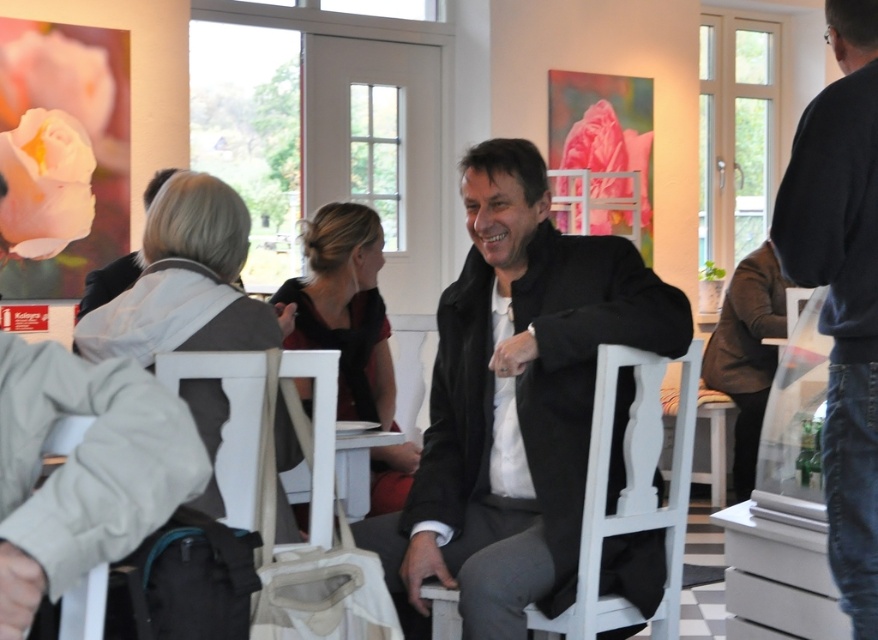
Please look at the scene and locate the point at coordinates (x=841, y=289). What object or feature is located at this position?

The point at coordinates (x=841, y=289) corresponds to the dark blue shirt at right.